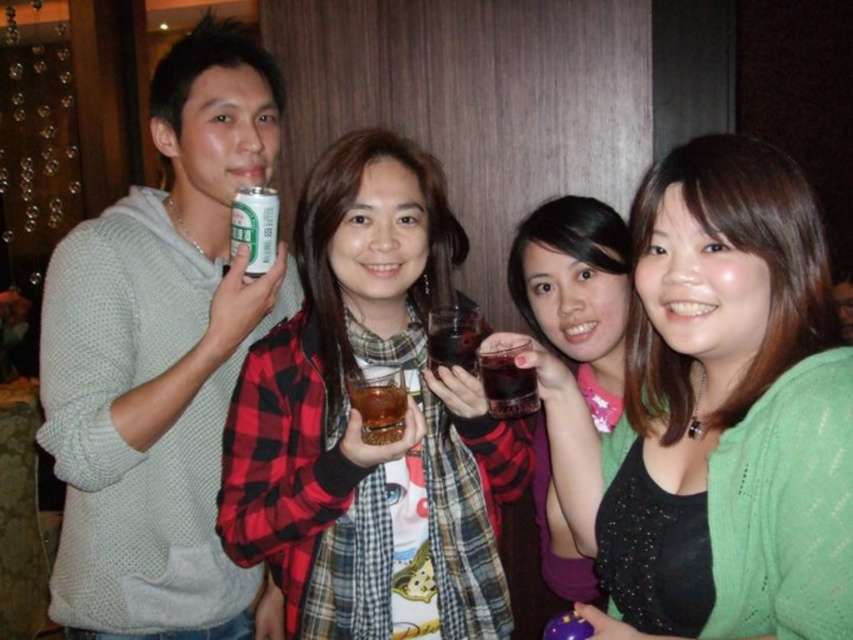
Question: Which point appears closest to the camera in this image?

Choices:
 (A) (595, 227)
 (B) (791, 461)
 (C) (345, 340)
 (D) (248, 198)

Answer: (B)

Question: Considering the real-world distances, which object is closest to the white knitted sweater at upper left?

Choices:
 (A) green matte can at upper left
 (B) plaid fabric shirt at center
 (C) matte black glass at center
 (D) translucent glass cup at center

Answer: (A)

Question: Which is farther from the white knitted sweater at upper left?

Choices:
 (A) green matte can at upper left
 (B) matte black glass at center
 (C) translucent glass at center

Answer: (B)

Question: Can you confirm if plaid fabric shirt at center is thinner than green matte can at upper left?

Choices:
 (A) no
 (B) yes

Answer: (A)

Question: Is green matte can at upper left further to camera compared to translucent glass at center?

Choices:
 (A) no
 (B) yes

Answer: (B)

Question: Does white knitted sweater at upper left appear over translucent glass cup at center?

Choices:
 (A) yes
 (B) no

Answer: (A)